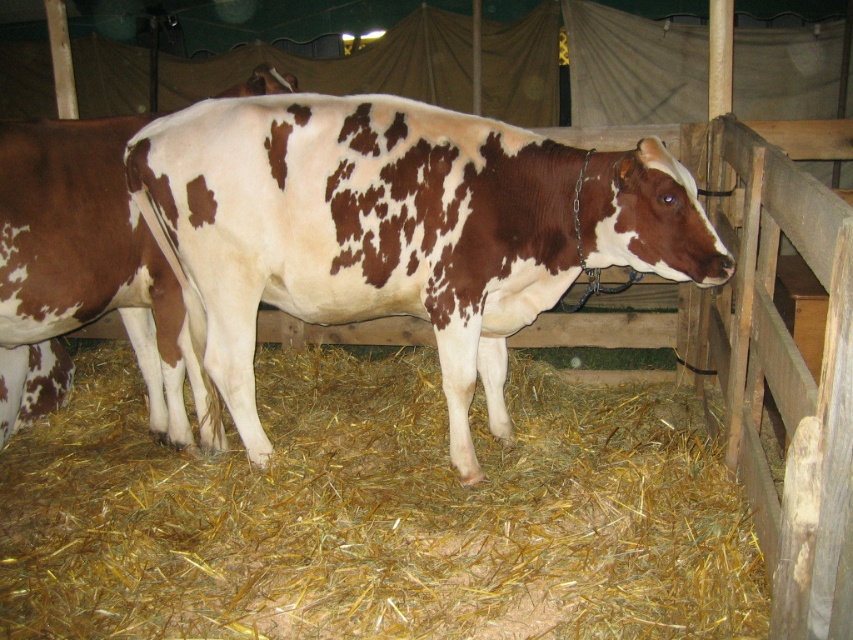
You are a farmer checking the barn. You see the yellow straw at lower center and the brown spotted cow at center. Which one takes up more space in the barn?

The yellow straw at lower center takes up more space in the barn because it is bigger than the brown spotted cow at center.